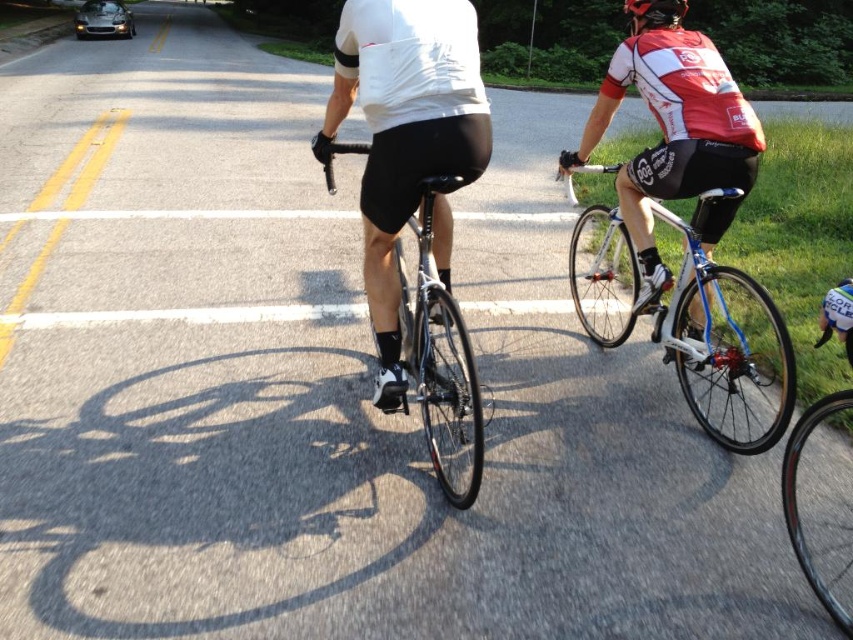
You are a photographer standing at the camera position. You want to take a photo that includes both point (404,300) and point (672,24). Which point will appear larger in the photo?

Point (404,300) will appear larger in the photo because it is closer to the camera than point (672,24).